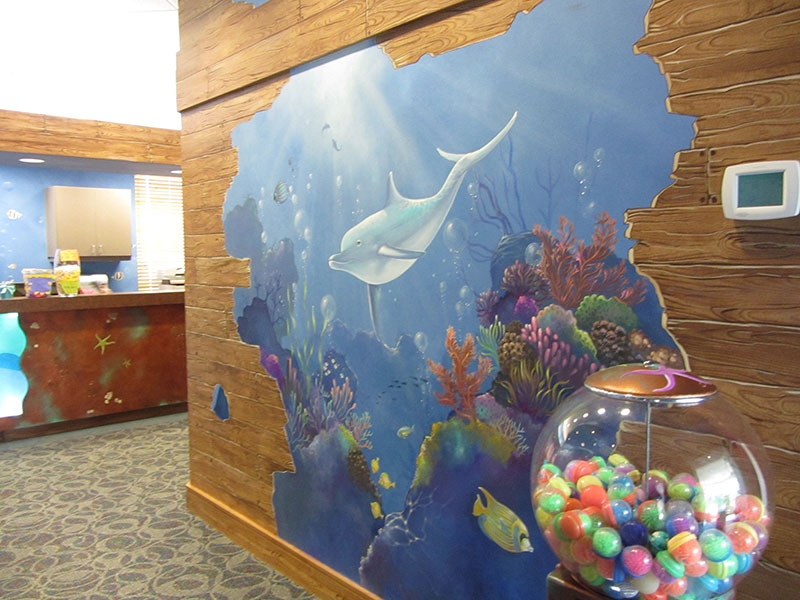
I want to click on cabinet, so click(82, 221).